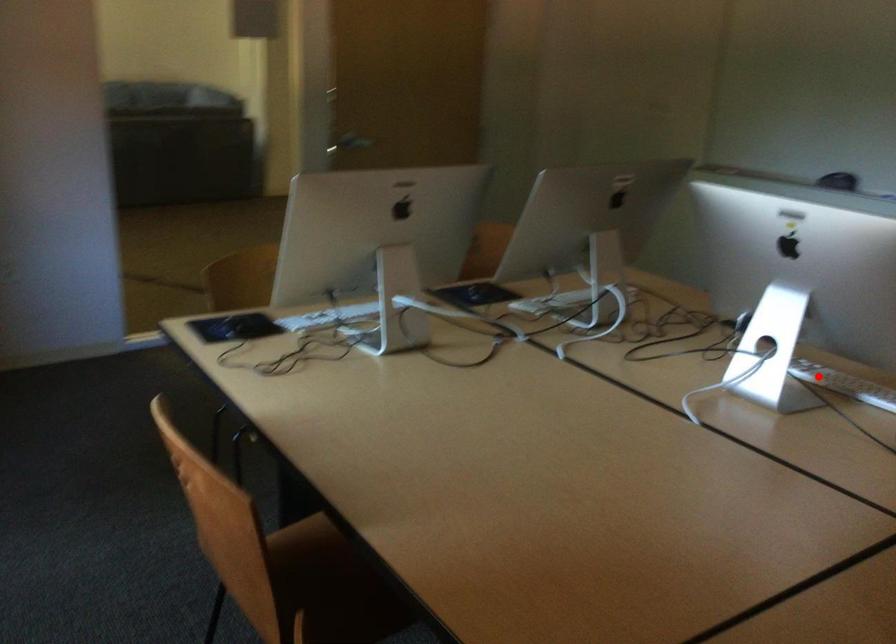
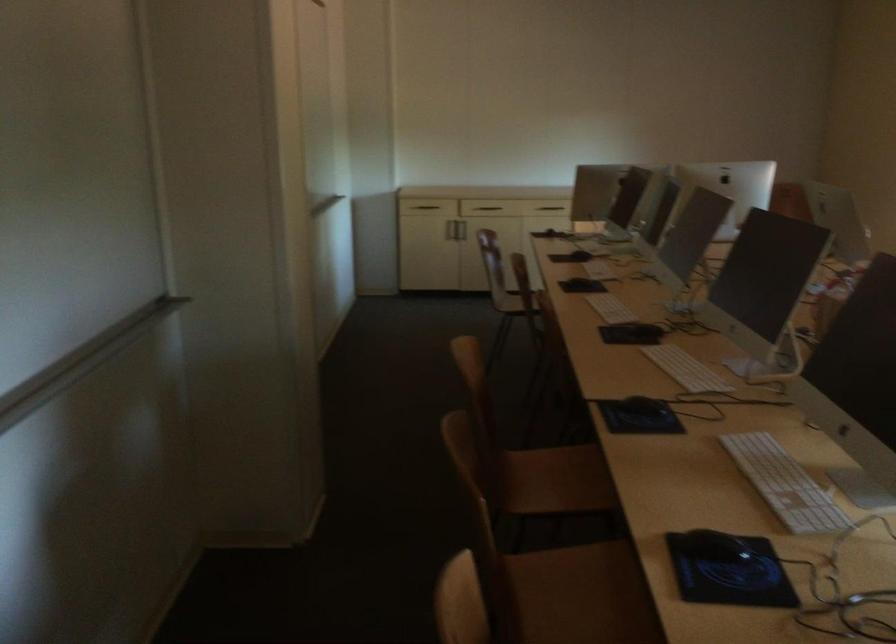
Question: A red point is marked in image1. In image2, is the corresponding 3D point closer to the camera or farther? Reply with the corresponding letter.

Choices:
 (A) The corresponding 3D point is closer.
 (B) The corresponding 3D point is farther.

Answer: (A)